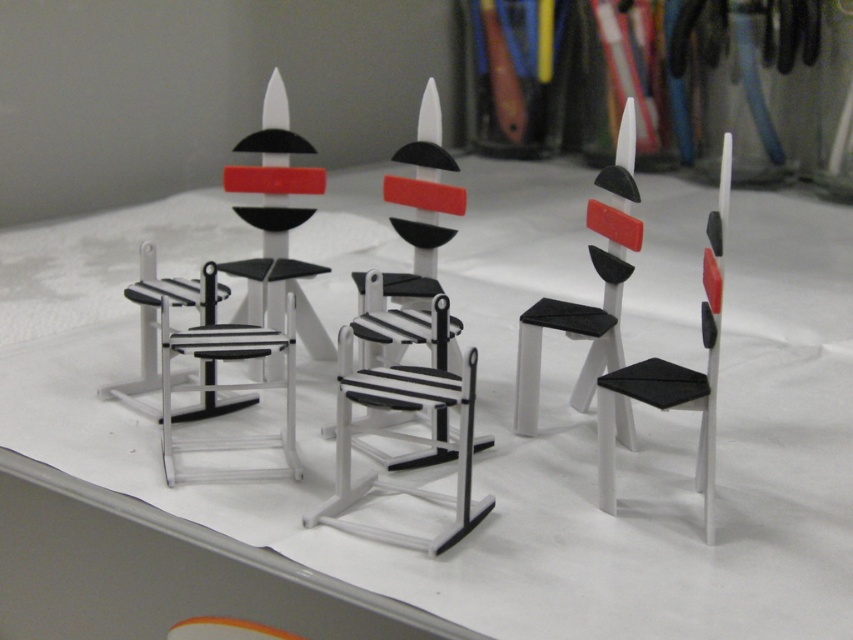
Question: Among these points, which one is nearest to the camera?

Choices:
 (A) (611, 216)
 (B) (183, 444)
 (C) (701, 262)
 (D) (216, 404)

Answer: (B)

Question: Which is nearer to the matte black chair at center right?

Choices:
 (A) black matte/striped chair at left
 (B) matte black chair at center

Answer: (B)

Question: Which object is closer to the camera taking this photo?

Choices:
 (A) black matte/striped chair at left
 (B) matte black chair at left

Answer: (A)

Question: Does black matte/striped chair at left come in front of matte black chair at center right?

Choices:
 (A) yes
 (B) no

Answer: (B)

Question: Is black matte/striped chair at left wider than matte black chair at left?

Choices:
 (A) yes
 (B) no

Answer: (A)

Question: Does matte black chair at center right have a lesser width compared to matte black chair at left?

Choices:
 (A) yes
 (B) no

Answer: (A)